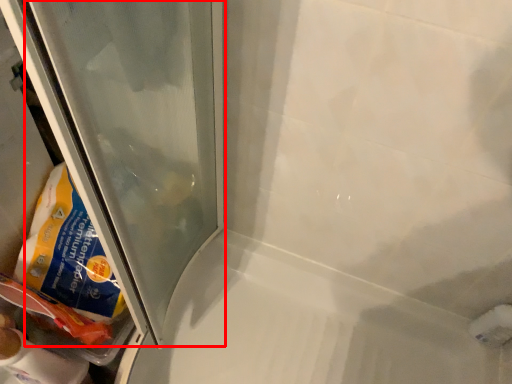
Question: From the image's perspective, what is the correct spatial positioning of glass door (annotated by the red box) in reference to bath?

Choices:
 (A) above
 (B) below

Answer: (A)